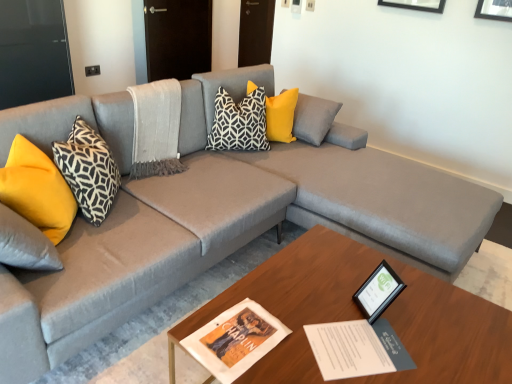
Question: Looking at their shapes, would you say black glossy picture frame at lower right is wider or thinner than yellow fabric pillow at left, which ranks as the first pillow in left-to-right order?

Choices:
 (A) wide
 (B) thin

Answer: (B)

Question: In terms of height, does black glossy picture frame at lower right look taller or shorter compared to yellow fabric pillow at left, placed as the 4th pillow when sorted from right to left?

Choices:
 (A) short
 (B) tall

Answer: (A)

Question: Which object is the closest to the white paper booklet at center?

Choices:
 (A) black glossy picture frame at lower right
 (B) yellow fabric pillow at left, placed as the 4th pillow when sorted from right to left
 (C) black and white geometric pillow at center, the second pillow viewed from the right
 (D) wooden coffee table at center
 (E) black and white geometric pillow at left, arranged as the 2th pillow when viewed from the left

Answer: (A)

Question: Based on their relative distances, which object is nearer to the yellow fabric pillow at left, placed as the 4th pillow when sorted from right to left?

Choices:
 (A) yellow fabric pillow at center, placed as the first pillow when sorted from right to left
 (B) black and white geometric pillow at center, the second pillow viewed from the right
 (C) wooden coffee table at center
 (D) white paper booklet at center
 (E) black and white geometric pillow at left, marked as the third pillow in a right-to-left arrangement

Answer: (E)